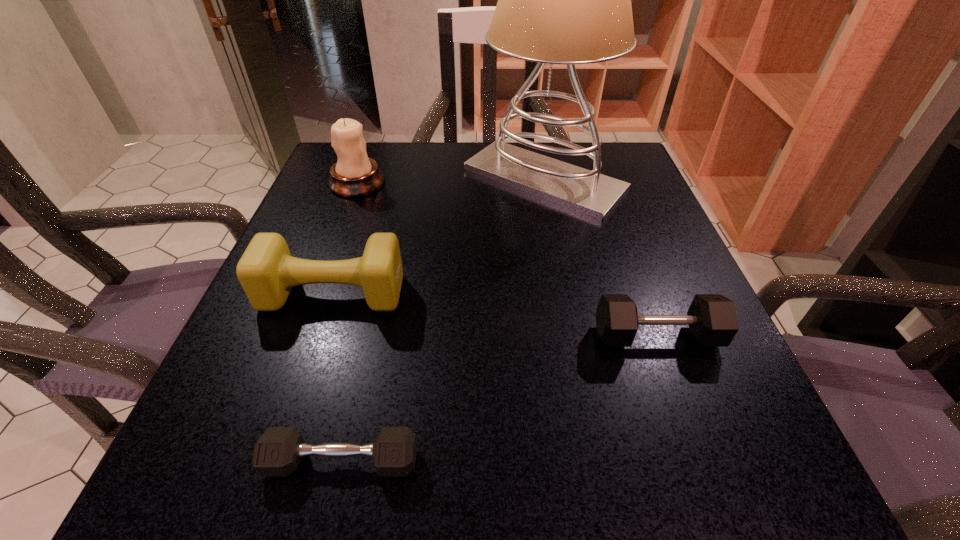
Find the location of a particular element. Image resolution: width=960 pixels, height=540 pixels. free spot between the shortest dumbbell and the second nearest dumbbell is located at coordinates (499, 399).

The image size is (960, 540). Identify the location of vacant area that lies between the candle holder and the shortest object. click(x=349, y=322).

You are a GUI agent. You are given a task and a screenshot of the screen. Output one action in this format:
    pyautogui.click(x=<x>, y=<y>)
    Task: Click on the free space between the nearest object and the table lamp
    
    Given the screenshot: What is the action you would take?
    pyautogui.click(x=443, y=320)

Where is `free space between the third nearest object and the fourth farthest object`? The width and height of the screenshot is (960, 540). free space between the third nearest object and the fourth farthest object is located at coordinates (494, 315).

This screenshot has width=960, height=540. Find the location of `free space between the second tallest object and the rightmost dumbbell`. free space between the second tallest object and the rightmost dumbbell is located at coordinates (507, 260).

Find the location of a particular element. unoccupied area between the table lamp and the candle holder is located at coordinates (450, 181).

Where is `the fourth closest object to the shortest object`? The image size is (960, 540). the fourth closest object to the shortest object is located at coordinates (354, 174).

Identify which object is the third closest to the third shortest object. Please provide its 2D coordinates. Your answer should be formatted as a tuple, i.e. [(x, y)], where the tuple contains the x and y coordinates of a point satisfying the conditions above.

[(354, 174)]

Where is `the second closest dumbbell to the second farthest dumbbell`? This screenshot has width=960, height=540. the second closest dumbbell to the second farthest dumbbell is located at coordinates (267, 272).

At what (x,y) coordinates should I click in order to perform the action: click on dumbbell identified as the second closest to the third shortest object. Please return your answer as a coordinate pair (x, y). Image resolution: width=960 pixels, height=540 pixels. Looking at the image, I should click on (712, 320).